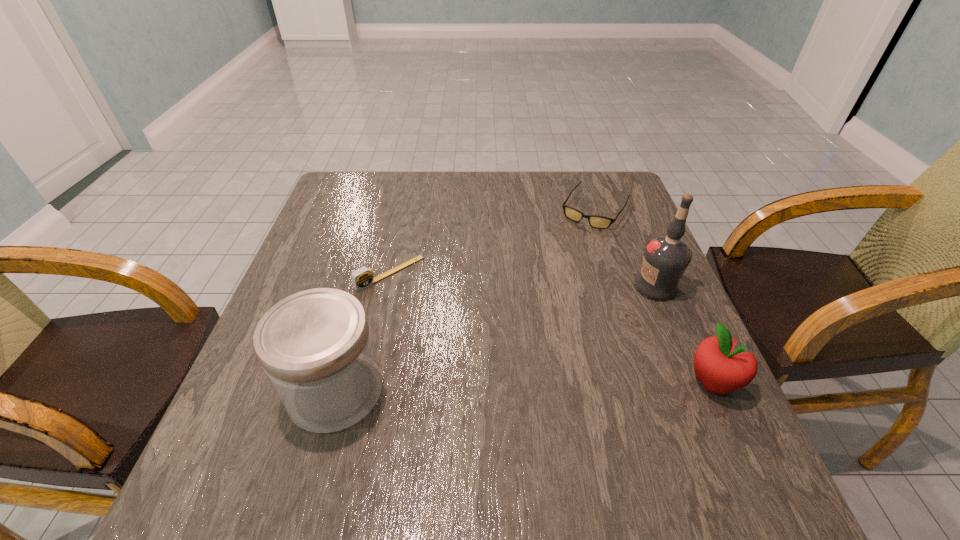
At what (x,y) coordinates should I click in order to perform the action: click on blank area located 0.390m at the front of the tape measure with the tape extended. Please return your answer as a coordinate pair (x, y). Looking at the image, I should click on (523, 400).

Identify the location of free space located 0.250m at the front of the tape measure with the tape extended. (475, 354).

Identify the location of vacant space located at the front of the tape measure with the tape extended. 441,320.

Locate an element on the screen. The width and height of the screenshot is (960, 540). vacant space positioned on the front-facing side of the farthest object is located at coordinates (x=564, y=257).

Locate an element on the screen. The width and height of the screenshot is (960, 540). vacant space located on the front-facing side of the farthest object is located at coordinates (572, 244).

In order to click on free location located on the front-facing side of the farthest object in this screenshot , I will do click(540, 294).

At what (x,y) coordinates should I click in order to perform the action: click on object located in the far edge section of the desktop. Please return your answer as a coordinate pair (x, y). This screenshot has width=960, height=540. Looking at the image, I should click on (595, 221).

The width and height of the screenshot is (960, 540). In order to click on jar present at the near edge in this screenshot , I will do `click(316, 348)`.

Find the location of a particular element. The height and width of the screenshot is (540, 960). apple situated at the near edge is located at coordinates (721, 370).

Where is `jar present at the left edge`? The height and width of the screenshot is (540, 960). jar present at the left edge is located at coordinates (316, 348).